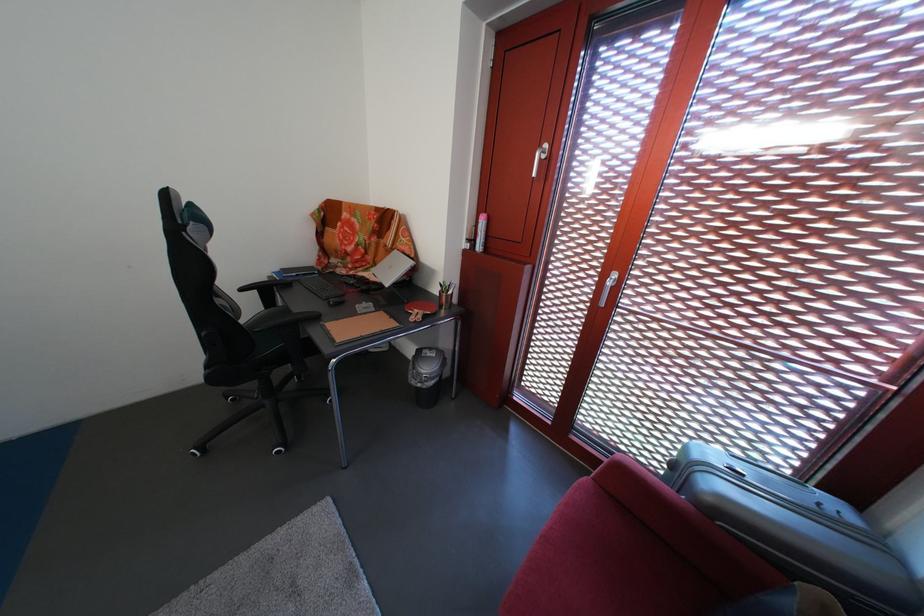
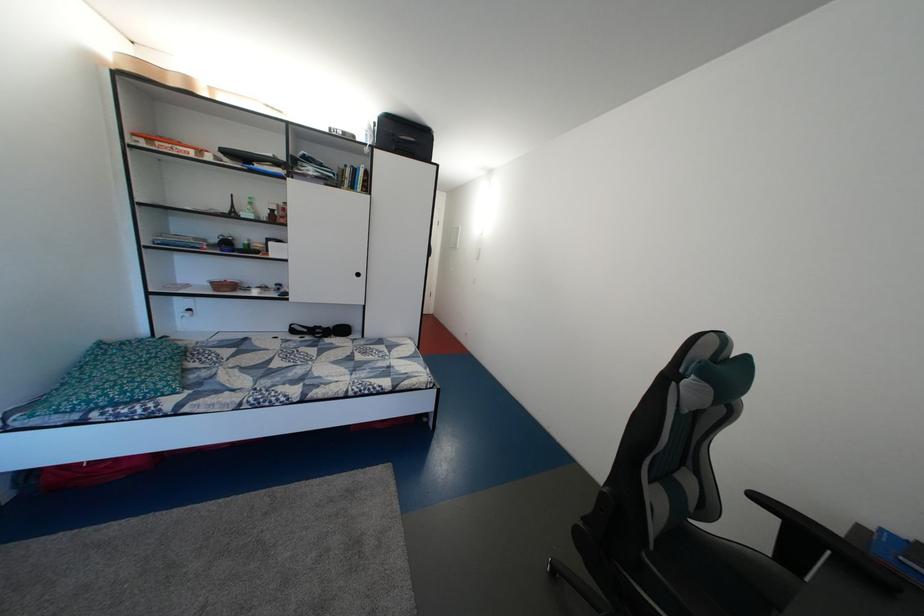
Question: I am providing you with two images of the same scene from different viewpoints. Please identify which objects are invisible in image2.

Choices:
 (A) bed sitting surface
 (B) small brown basket
 (C) black suitcase
 (D) none of these

Answer: (D)